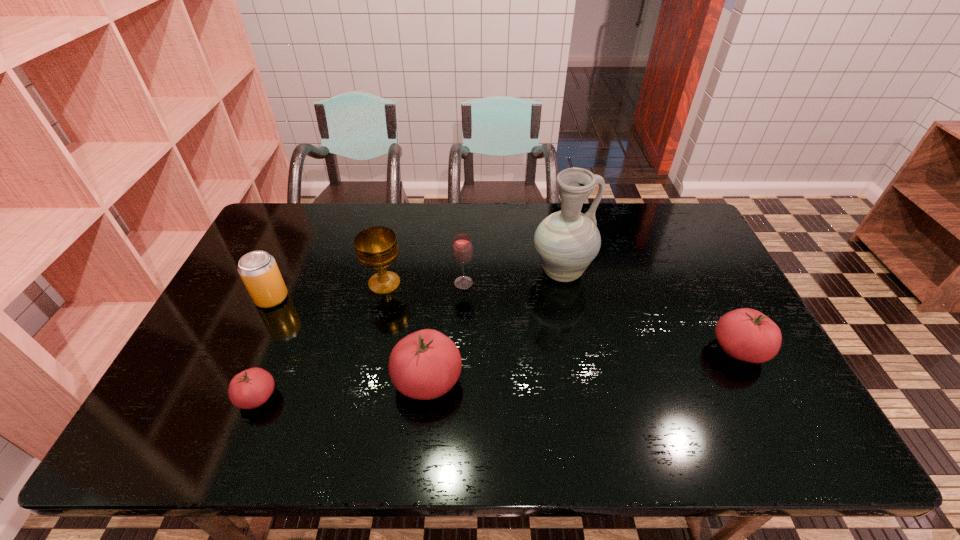
Locate an element on the screen. free space between the shortest object and the second tomato from right to left is located at coordinates (343, 389).

At what (x,y) coordinates should I click in order to perform the action: click on unoccupied position between the pitcher and the glass drink container. Please return your answer as a coordinate pair (x, y). The height and width of the screenshot is (540, 960). Looking at the image, I should click on (513, 278).

This screenshot has width=960, height=540. I want to click on vacant area between the shortest tomato and the fifth object from right to left, so click(x=321, y=340).

Locate which object is the fourth closest to the pitcher. Please provide its 2D coordinates. Your answer should be formatted as a tuple, i.e. [(x, y)], where the tuple contains the x and y coordinates of a point satisfying the conditions above.

[(376, 247)]

Locate which object is the third closest to the chalice. Please provide its 2D coordinates. Your answer should be formatted as a tuple, i.e. [(x, y)], where the tuple contains the x and y coordinates of a point satisfying the conditions above.

[(258, 270)]

Identify which tomato is the closest to the rightmost tomato. Please provide its 2D coordinates. Your answer should be formatted as a tuple, i.e. [(x, y)], where the tuple contains the x and y coordinates of a point satisfying the conditions above.

[(426, 364)]

Locate an element on the screen. The image size is (960, 540). tomato that is the nearest to the second tomato from left to right is located at coordinates (251, 388).

In order to click on free location that satisfies the following two spatial constraints: 1. on the front side of the second tomato from left to right; 2. on the left side of the pop (soda) in this screenshot , I will do `click(233, 380)`.

This screenshot has width=960, height=540. I want to click on vacant space that satisfies the following two spatial constraints: 1. on the back side of the leftmost tomato; 2. on the left side of the glass drink container, so click(x=303, y=284).

The height and width of the screenshot is (540, 960). In order to click on free location that satisfies the following two spatial constraints: 1. on the handle side of the tallest object; 2. on the front side of the leftmost tomato in this screenshot , I will do `click(586, 397)`.